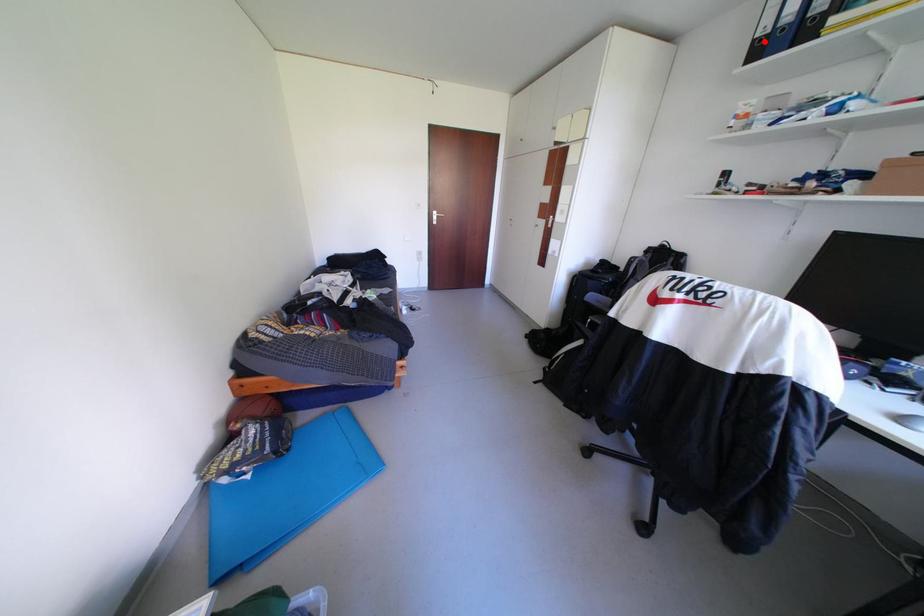
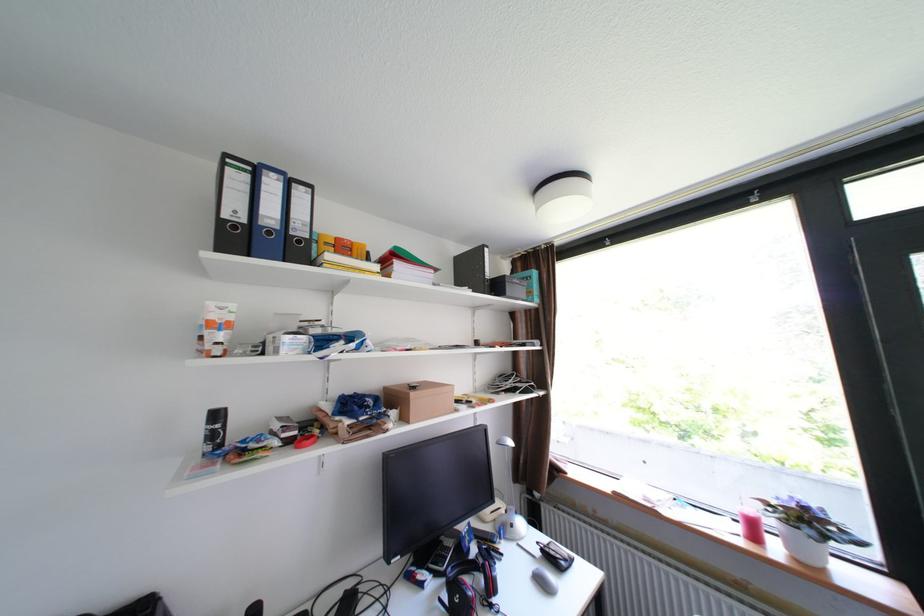
Locate, in the second image, the point that corresponds to the highlighted location in the first image.

(232, 221)